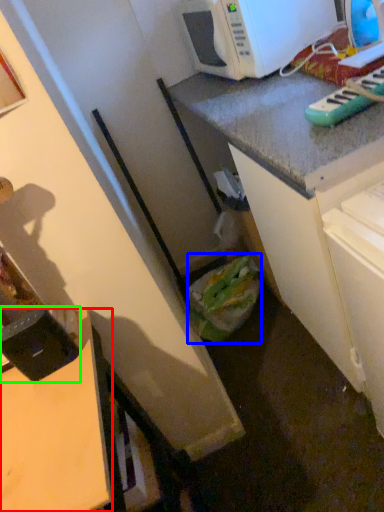
Question: Based on their relative distances, which object is farther from desk (highlighted by a red box)? Choose from garbage (highlighted by a blue box) and appliance (highlighted by a green box).

Choices:
 (A) garbage
 (B) appliance

Answer: (A)